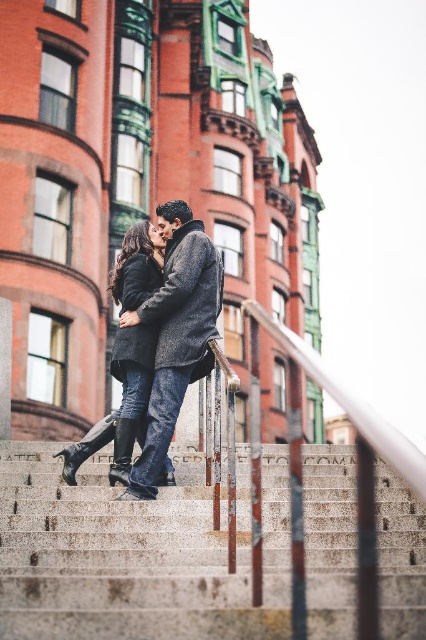
Question: Does concrete stairs at center lie in front of dark gray wool coat at center?

Choices:
 (A) yes
 (B) no

Answer: (A)

Question: Considering the real-world distances, which object is farthest from the concrete stairs at center?

Choices:
 (A) velvet black coat at center
 (B) dark gray wool coat at center

Answer: (A)

Question: Considering the real-world distances, which object is farthest from the concrete stairs at center?

Choices:
 (A) dark gray wool coat at center
 (B) velvet black coat at center

Answer: (B)

Question: Which of these objects is positioned closest to the concrete stairs at center?

Choices:
 (A) velvet black coat at center
 (B) dark gray wool coat at center

Answer: (B)

Question: Does dark gray wool coat at center have a lesser width compared to velvet black coat at center?

Choices:
 (A) no
 (B) yes

Answer: (A)

Question: Observing the image, what is the correct spatial positioning of concrete stairs at center in reference to dark gray wool coat at center?

Choices:
 (A) below
 (B) above

Answer: (A)